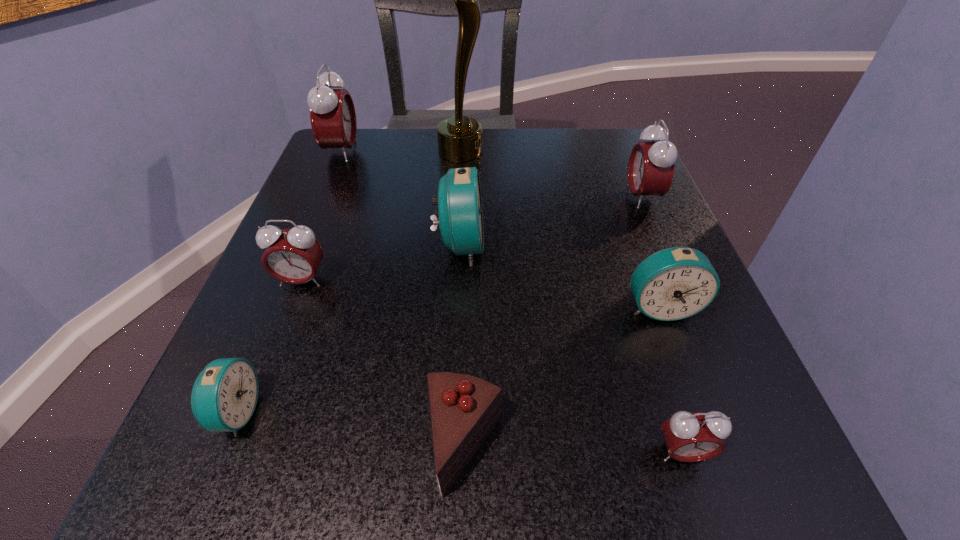
The width and height of the screenshot is (960, 540). What are the coordinates of `object located in the near right corner section of the desktop` in the screenshot? It's located at (689, 437).

The height and width of the screenshot is (540, 960). Identify the location of blank space at the far edge of the desktop. (538, 186).

I want to click on vacant area at the left edge of the desktop, so click(x=341, y=198).

Locate an element on the screen. Image resolution: width=960 pixels, height=540 pixels. vacant space at the right edge of the desktop is located at coordinates (621, 193).

At what (x,y) coordinates should I click in order to perform the action: click on vacant region at the far left corner of the desktop. Please return your answer as a coordinate pair (x, y). Looking at the image, I should click on (x=353, y=160).

Where is `free space at the near left corner of the desktop`? free space at the near left corner of the desktop is located at coordinates (228, 467).

In the image, there is a desktop. Find the location of `vacant space at the near right corner`. vacant space at the near right corner is located at coordinates (721, 455).

Locate an element on the screen. This screenshot has width=960, height=540. free area in between the tallest object and the nearest pink alarm clock is located at coordinates (571, 301).

I want to click on free spot between the fourth alarm clock from right to left and the rightmost blue alarm clock, so click(x=560, y=276).

Where is `vacant region between the biggest blue alarm clock and the second smallest blue alarm clock`? vacant region between the biggest blue alarm clock and the second smallest blue alarm clock is located at coordinates (560, 276).